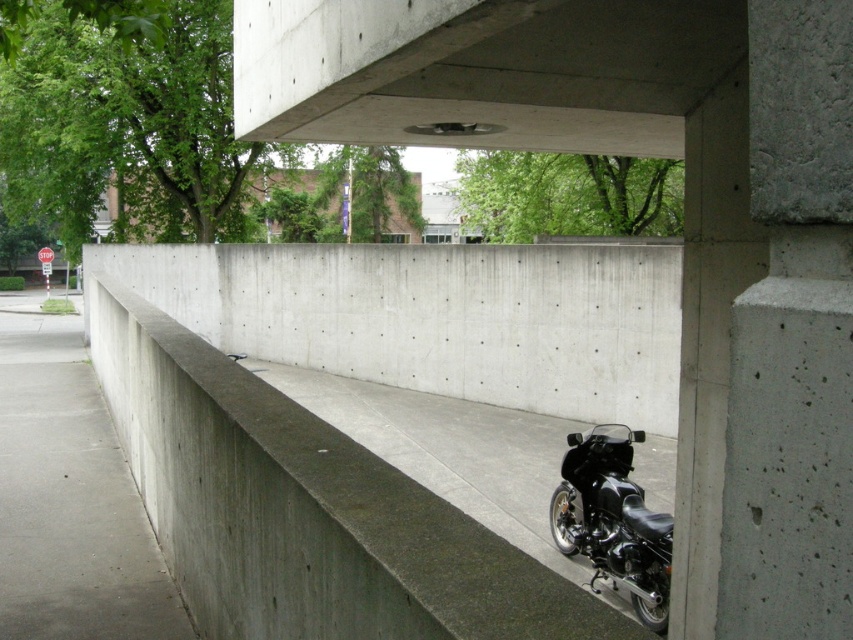
Question: Can you confirm if concrete at lower right is positioned below black matte motorcycle at lower right?

Choices:
 (A) no
 (B) yes

Answer: (A)

Question: Which point is closer to the camera?

Choices:
 (A) black matte motorcycle at lower right
 (B) concrete at lower right

Answer: (B)

Question: Based on their relative distances, which object is farther from the black matte motorcycle at lower right?

Choices:
 (A) concrete at lower right
 (B) concrete at upper center

Answer: (A)

Question: Is concrete at upper center below black matte motorcycle at lower right?

Choices:
 (A) no
 (B) yes

Answer: (A)

Question: Is concrete at lower right behind black matte motorcycle at lower right?

Choices:
 (A) no
 (B) yes

Answer: (A)

Question: Which point is closer to the camera?

Choices:
 (A) concrete at upper center
 (B) black matte motorcycle at lower right

Answer: (A)